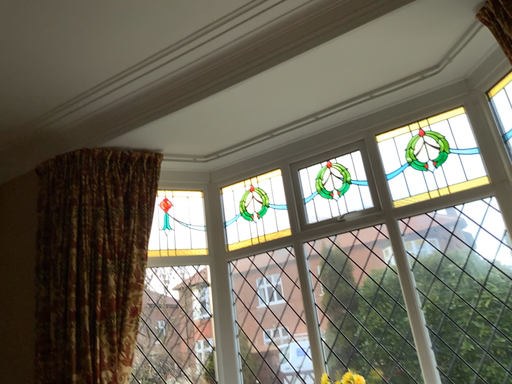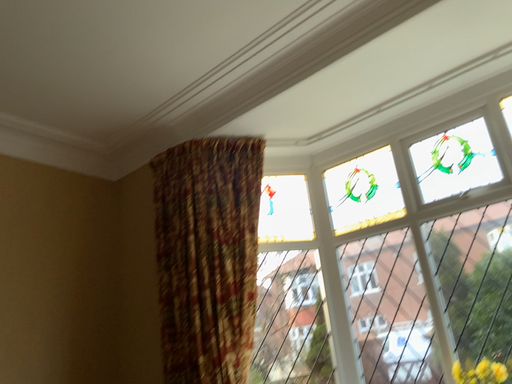
Question: How did the camera likely rotate when shooting the video?

Choices:
 (A) rotated left
 (B) rotated right

Answer: (A)